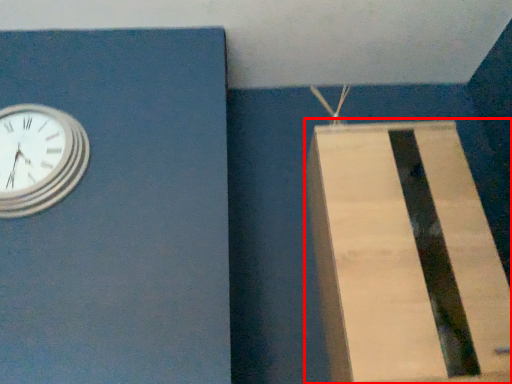
Question: From the image's perspective, considering the relative positions of cardboard box (annotated by the red box) and wall clock in the image provided, where is cardboard box (annotated by the red box) located with respect to the staircase?

Choices:
 (A) above
 (B) below

Answer: (B)